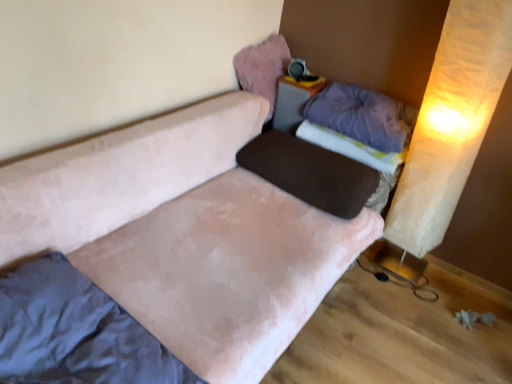
Where is `vacant area that is situated to the right of beige paper curtain at right`? The height and width of the screenshot is (384, 512). vacant area that is situated to the right of beige paper curtain at right is located at coordinates (442, 289).